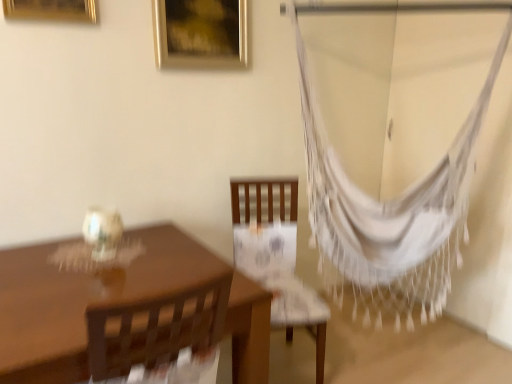
From the picture: Measure the distance between point [21,286] and camera.

The distance of point [21,286] from camera is 4.72 feet.

Describe the element at coordinates (52, 10) in the screenshot. I see `gold metallic picture frame at upper left, the 1th picture frame viewed from the front` at that location.

Looking at this image, measure the distance between gold metallic picture frame at upper left, which is the second picture frame from right to left, and camera.

gold metallic picture frame at upper left, which is the second picture frame from right to left, is 5.34 feet away from camera.

Find the location of `matte brown table at left`. matte brown table at left is located at coordinates (82, 300).

Does matte brown table at left turn towards gold metallic picture frame at upper left, which is the 1th picture frame from left to right?

No, matte brown table at left is not oriented towards gold metallic picture frame at upper left, which is the 1th picture frame from left to right.

Considering the relative sizes of matte brown table at left and gold metallic picture frame at upper left, which is the 1th picture frame from left to right, in the image provided, is matte brown table at left thinner than gold metallic picture frame at upper left, which is the 1th picture frame from left to right,?

No, matte brown table at left is not thinner than gold metallic picture frame at upper left, which is the 1th picture frame from left to right.

Looking at this image, considering the relative sizes of matte brown table at left and gold metallic picture frame at upper left, the 1th picture frame viewed from the front, in the image provided, is matte brown table at left bigger than gold metallic picture frame at upper left, the 1th picture frame viewed from the front,?

Yes.

From the image's perspective, which one is positioned higher, matte brown table at left or gold metallic picture frame at upper left, which is the 1th picture frame from left to right?

gold metallic picture frame at upper left, which is the 1th picture frame from left to right, is shown above in the image.

From the image's perspective, relative to gold metallic picture frame at upper left, placed as the second picture frame when sorted from back to front, is gold metallic picture frame at upper center, the 1th picture frame viewed from the right, above or below?

Based on their image positions, gold metallic picture frame at upper center, the 1th picture frame viewed from the right, is located beneath gold metallic picture frame at upper left, placed as the second picture frame when sorted from back to front.

Between gold metallic picture frame at upper center, arranged as the 2th picture frame when viewed from the left, and gold metallic picture frame at upper left, which is the second picture frame from right to left, which one has larger size?

gold metallic picture frame at upper center, arranged as the 2th picture frame when viewed from the left.

From the picture: Is the position of gold metallic picture frame at upper center, the 1th picture frame viewed from the right, less distant than that of gold metallic picture frame at upper left, which is the 1th picture frame from left to right?

No, it is behind gold metallic picture frame at upper left, which is the 1th picture frame from left to right.

Is wooden chair at center positioned far away from matte brown table at left?

That's not correct — wooden chair at center is a little close to matte brown table at left.

Is wooden chair at center wider or thinner than matte brown table at left?

wooden chair at center is thinner than matte brown table at left.

From the image's perspective, is wooden chair at center over matte brown table at left?

Indeed, from the image's perspective, wooden chair at center is shown above matte brown table at left.

Is wooden chair at center to the left of matte brown table at left from the viewer's perspective?

Incorrect, wooden chair at center is not on the left side of matte brown table at left.

From the image's perspective, is gold metallic picture frame at upper left, placed as the second picture frame when sorted from back to front, located beneath wooden chair at center?

Incorrect, from the image's perspective, gold metallic picture frame at upper left, placed as the second picture frame when sorted from back to front, is higher than wooden chair at center.

Would you say gold metallic picture frame at upper left, which is the second picture frame from right to left, contains wooden chair at center?

That's incorrect, wooden chair at center is not inside gold metallic picture frame at upper left, which is the second picture frame from right to left.

Is point (208, 24) behind point (237, 216)?

No, it is not.

Consider the image. Between gold metallic picture frame at upper center, arranged as the 2th picture frame when viewed from the left, and wooden chair at center, which one has larger width?

wooden chair at center.

Is gold metallic picture frame at upper center, the 1th picture frame viewed from the right, aimed at wooden chair at center?

No.

Between matte brown table at left and gold metallic picture frame at upper center, the 1th picture frame viewed from the right, which one appears on the left side from the viewer's perspective?

matte brown table at left.

This screenshot has height=384, width=512. Find the location of `picture frame that appears on the right of matte brown table at left`. picture frame that appears on the right of matte brown table at left is located at coordinates (200, 33).

Looking at this image, how many degrees apart are the facing directions of matte brown table at left and gold metallic picture frame at upper center, the 1th picture frame viewed from the right?

matte brown table at left and gold metallic picture frame at upper center, the 1th picture frame viewed from the right, are facing 0.435 degrees away from each other.

This screenshot has width=512, height=384. I want to click on chair that is above the matte brown table at left (from a real-world perspective), so click(276, 256).

Measure the distance from matte brown table at left to wooden chair at center.

matte brown table at left and wooden chair at center are 23.32 inches apart.

Which of these two, matte brown table at left or wooden chair at center, is wider?

matte brown table at left.

Who is smaller, matte brown table at left or wooden chair at center?

Smaller between the two is wooden chair at center.

Where is `picture frame on the left side of matte brown table at left`? picture frame on the left side of matte brown table at left is located at coordinates (52, 10).

Locate an element on the screen. The width and height of the screenshot is (512, 384). picture frame behind the gold metallic picture frame at upper left, placed as the second picture frame when sorted from back to front is located at coordinates (200, 33).

Looking at the image, which one is located further to matte brown table at left, white woven hammock at right or gold metallic picture frame at upper left, placed as the second picture frame when sorted from back to front?

Among the two, gold metallic picture frame at upper left, placed as the second picture frame when sorted from back to front, is located further to matte brown table at left.

Which object lies further to the anchor point white woven hammock at right, gold metallic picture frame at upper left, which is the second picture frame from right to left, or gold metallic picture frame at upper center, placed as the 2th picture frame when sorted from front to back?

Among the two, gold metallic picture frame at upper left, which is the second picture frame from right to left, is located further to white woven hammock at right.

Estimate the real-world distances between objects in this image. Which object is closer to white woven hammock at right, wooden chair at center or matte brown table at left?

Based on the image, wooden chair at center appears to be nearer to white woven hammock at right.

When comparing their distances from wooden chair at center, does white woven hammock at right or gold metallic picture frame at upper left, which is the 1th picture frame from left to right, seem further?

Among the two, gold metallic picture frame at upper left, which is the 1th picture frame from left to right, is located further to wooden chair at center.

Looking at the image, which one is located closer to white woven hammock at right, matte brown table at left or wooden chair at center?

wooden chair at center lies closer to white woven hammock at right than the other object.

Which object lies nearer to the anchor point white woven hammock at right, gold metallic picture frame at upper center, arranged as the first picture frame when viewed from the back, or wooden chair at center?

wooden chair at center is positioned closer to the anchor white woven hammock at right.

When comparing their distances from wooden chair at center, does white woven hammock at right or matte brown table at left seem further?

Based on the image, matte brown table at left appears to be further to wooden chair at center.

Based on their spatial positions, is gold metallic picture frame at upper left, placed as the second picture frame when sorted from back to front, or wooden chair at center closer to gold metallic picture frame at upper center, arranged as the 2th picture frame when viewed from the left?

gold metallic picture frame at upper left, placed as the second picture frame when sorted from back to front, lies closer to gold metallic picture frame at upper center, arranged as the 2th picture frame when viewed from the left, than the other object.

What are the coordinates of `picture frame between gold metallic picture frame at upper left, which is the 1th picture frame from left to right, and wooden chair at center vertically` in the screenshot? It's located at (200, 33).

At what (x,y) coordinates should I click in order to perform the action: click on curtain between gold metallic picture frame at upper center, the 1th picture frame viewed from the right, and wooden chair at center in the up-down direction. Please return your answer as a coordinate pair (x, y). The image size is (512, 384). Looking at the image, I should click on (391, 202).

Where is `chair between matte brown table at left and white woven hammock at right from left to right`? This screenshot has width=512, height=384. chair between matte brown table at left and white woven hammock at right from left to right is located at coordinates (276, 256).

You are a GUI agent. You are given a task and a screenshot of the screen. Output one action in this format:
    pyautogui.click(x=<x>, y=<y>)
    Task: Click on the picture frame between gold metallic picture frame at upper left, placed as the second picture frame when sorted from back to front, and matte brown table at left from top to bottom
    Image resolution: width=512 pixels, height=384 pixels.
    Given the screenshot: What is the action you would take?
    point(200,33)